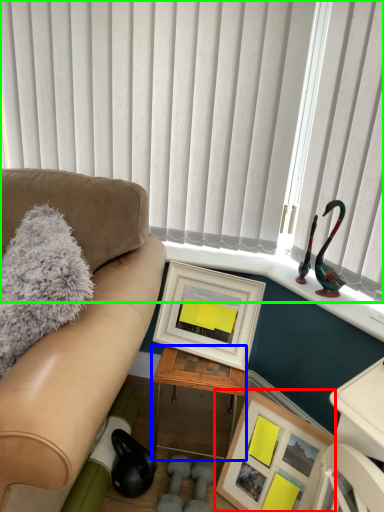
Question: Which object is positioned closest to picture frame (highlighted by a red box)? Select from table (highlighted by a blue box) and window blind (highlighted by a green box).

Choices:
 (A) table
 (B) window blind

Answer: (A)